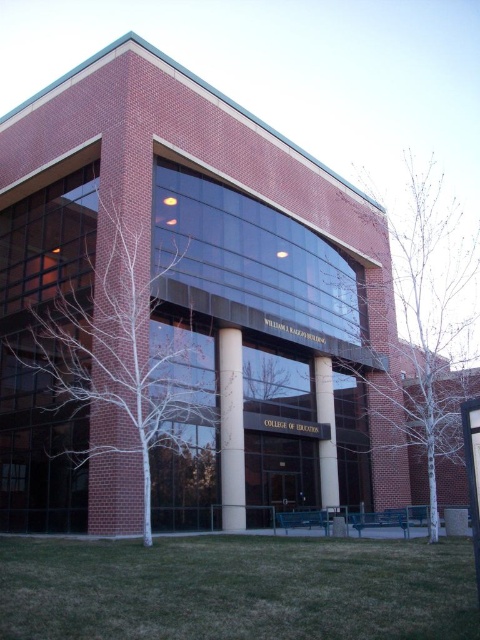
Question: From the image, what is the correct spatial relationship of bare branches at right in relation to bare branches at center?

Choices:
 (A) above
 (B) below

Answer: (A)

Question: Which of these objects is positioned closest to the green grass at lower center?

Choices:
 (A) bare branches at right
 (B) white bark tree at center

Answer: (B)

Question: Which point appears farthest from the camera in this image?

Choices:
 (A) (265, 374)
 (B) (213, 406)
 (C) (468, 243)

Answer: (C)

Question: Does bare branches at right have a greater width compared to white marble pillar at center?

Choices:
 (A) no
 (B) yes

Answer: (B)

Question: Which of the following is the farthest from the observer?

Choices:
 (A) (231, 413)
 (B) (254, 385)
 (C) (355, 609)

Answer: (B)

Question: Can you confirm if bare branches at center is bigger than slate gray concrete pillar at center?

Choices:
 (A) yes
 (B) no

Answer: (B)